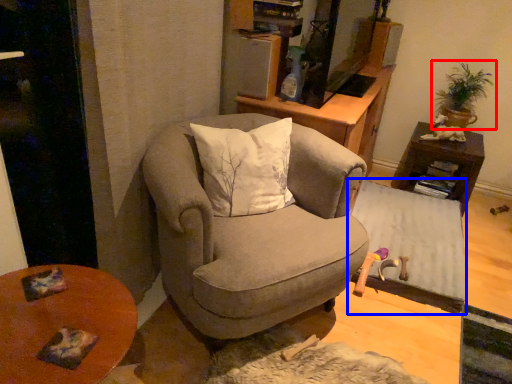
Question: Which of the following is the farthest to the observer, houseplant (highlighted by a red box) or table (highlighted by a blue box)?

Choices:
 (A) houseplant
 (B) table

Answer: (A)